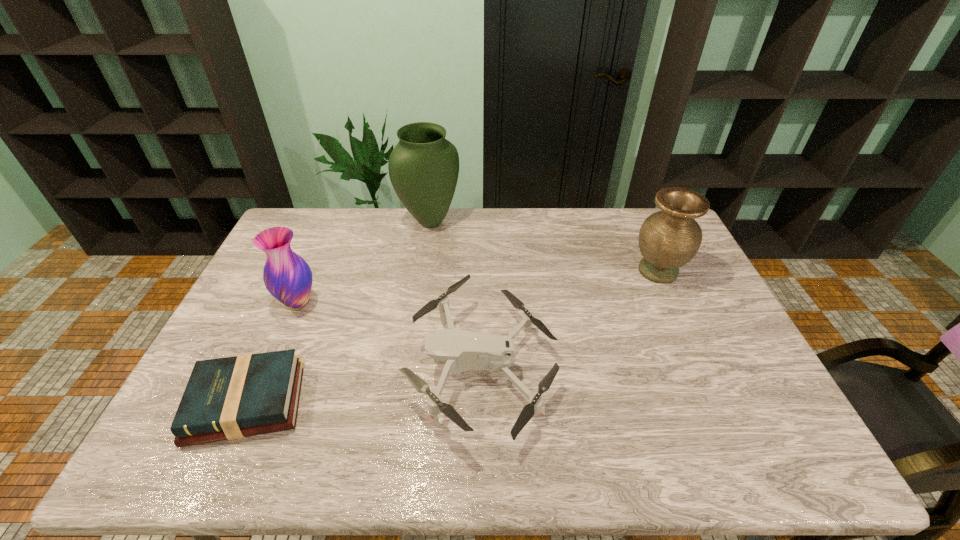
The height and width of the screenshot is (540, 960). I want to click on free spot at the far edge of the desktop, so click(x=628, y=240).

This screenshot has height=540, width=960. Find the location of `vacant space at the near edge`. vacant space at the near edge is located at coordinates (700, 435).

In the image, there is a desktop. Identify the location of vacant space at the left edge. point(265,289).

In the image, there is a desktop. Where is `free space at the right edge`? This screenshot has height=540, width=960. free space at the right edge is located at coordinates (720, 310).

Image resolution: width=960 pixels, height=540 pixels. Identify the location of vacant space that is in between the leftmost vase and the drone. (390, 335).

Locate an element on the screen. The height and width of the screenshot is (540, 960). free space between the tallest object and the rightmost object is located at coordinates (543, 246).

At what (x,y) coordinates should I click in order to perform the action: click on free space between the hardback book and the tallest vase. Please return your answer as a coordinate pair (x, y). This screenshot has height=540, width=960. Looking at the image, I should click on (338, 312).

Identify the location of vacant area between the leftmost vase and the farthest vase. (364, 262).

You are a GUI agent. You are given a task and a screenshot of the screen. Output one action in this format:
    pyautogui.click(x=<x>, y=<y>)
    Task: Click on the vacant point located between the rightmost object and the second shortest object
    This screenshot has height=540, width=960.
    Given the screenshot: What is the action you would take?
    pyautogui.click(x=570, y=319)

Locate an element on the screen. The height and width of the screenshot is (540, 960). free space that is in between the leftmost vase and the rightmost object is located at coordinates (478, 287).